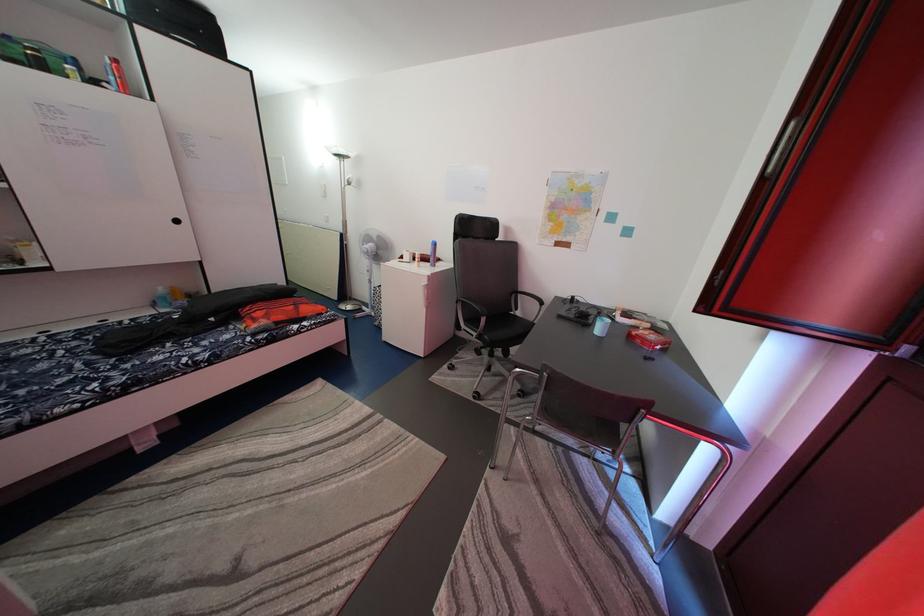
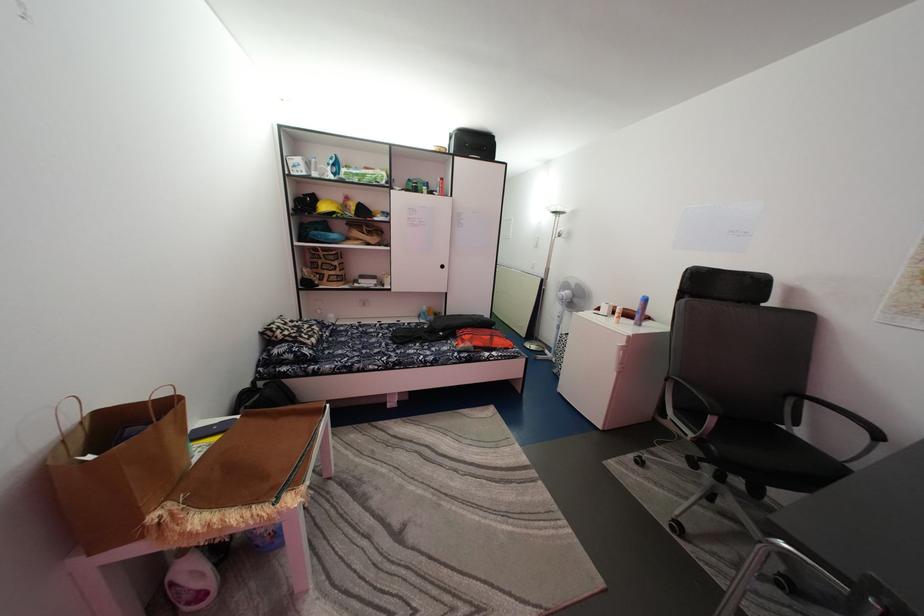
Locate, in the second image, the point that corresponds to point 433,265 in the first image.

(637, 322)